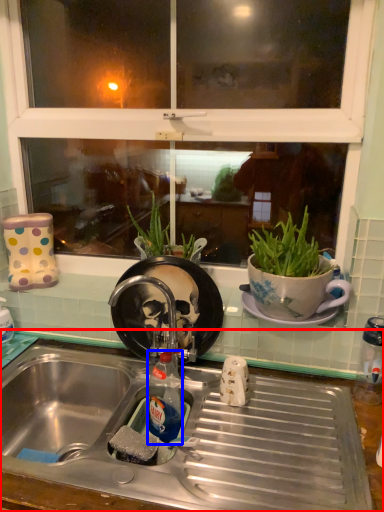
Question: Which of the following is the farthest to the observer, desk (highlighted by a red box) or bottle (highlighted by a blue box)?

Choices:
 (A) desk
 (B) bottle

Answer: (B)